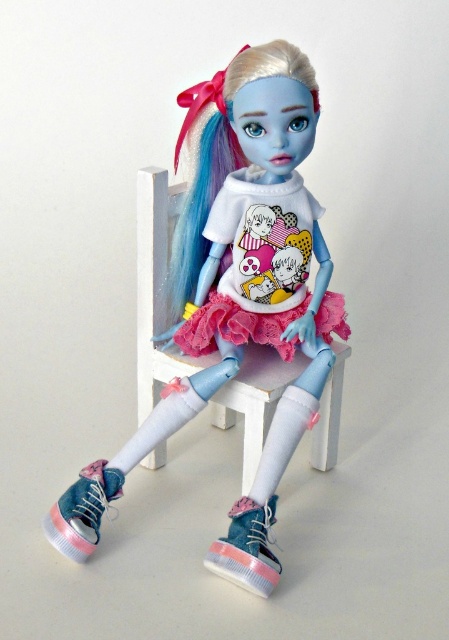
Can you confirm if pink lace dress at center is bigger than pink suede sneaker at lower center?

Yes.

Is pink lace dress at center below pink suede sneaker at lower center?

Incorrect, pink lace dress at center is not positioned below pink suede sneaker at lower center.

Between point (313, 216) and point (249, 573), which one is positioned behind?

Point (313, 216)

The image size is (449, 640). I want to click on pink lace dress at center, so click(x=256, y=266).

Can you confirm if matte white t-shirt at center is shorter than blue silky hair at center?

No.

Identify the location of matte white t-shirt at center. The width and height of the screenshot is (449, 640). (237, 275).

Is point (220, 145) in front of point (250, 534)?

No, it is not.

Is point (260, 60) less distant than point (245, 556)?

Yes, it is.

This screenshot has height=640, width=449. Find the location of `blue silky hair at center`. blue silky hair at center is located at coordinates (220, 148).